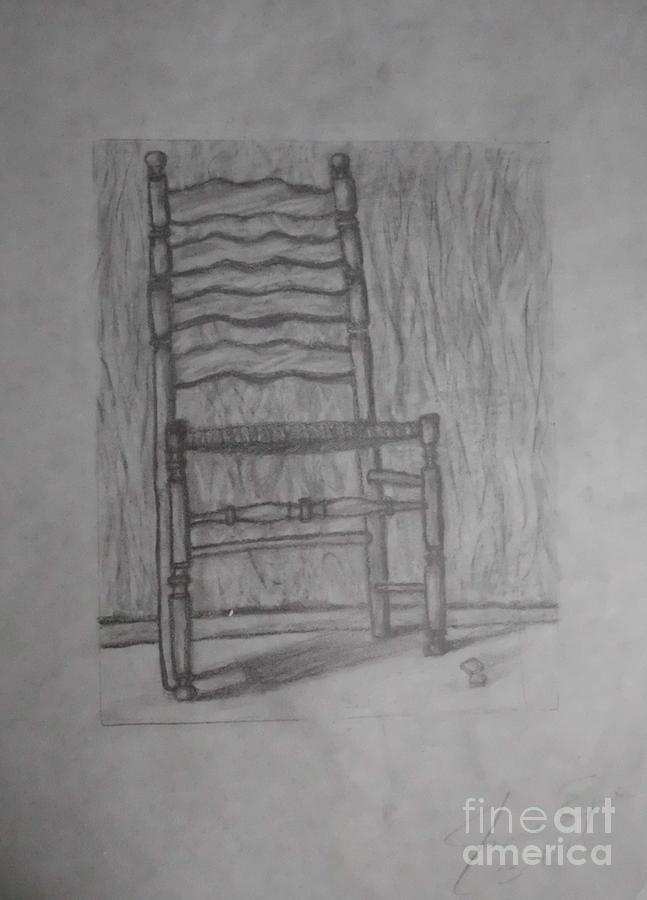
The image size is (647, 900). Find the location of `wavy back wood cut design on chair`. wavy back wood cut design on chair is located at coordinates (246, 250).